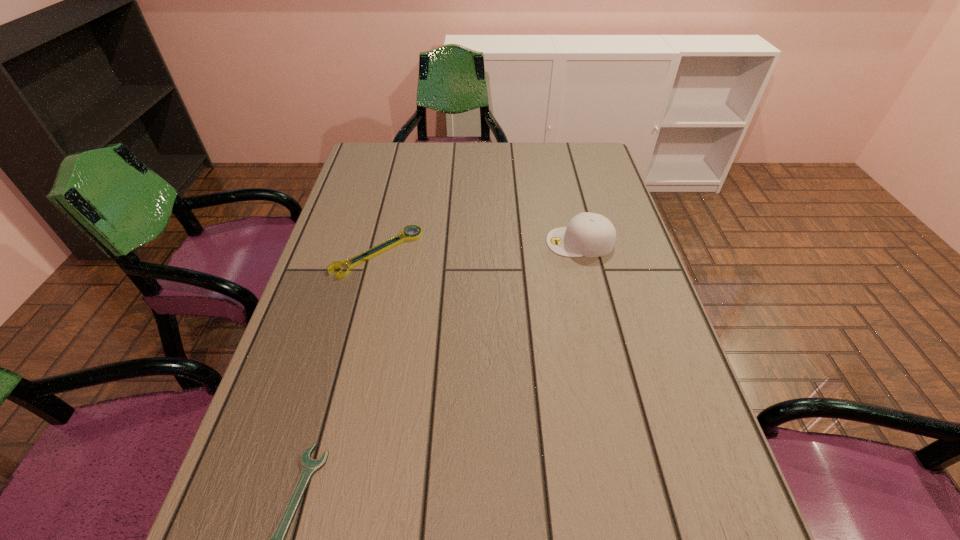
The height and width of the screenshot is (540, 960). Find the location of `free region at the right edge of the desktop`. free region at the right edge of the desktop is located at coordinates (679, 426).

Where is `vacant region at the far left corner`? Image resolution: width=960 pixels, height=540 pixels. vacant region at the far left corner is located at coordinates (355, 169).

This screenshot has height=540, width=960. What are the coordinates of `free point at the far right corner` in the screenshot? It's located at (594, 167).

You are a GUI agent. You are given a task and a screenshot of the screen. Output one action in this format:
    pyautogui.click(x=<x>, y=<y>)
    Task: Click on the free space between the farther wrench and the rightmost object
    Image resolution: width=960 pixels, height=540 pixels.
    Given the screenshot: What is the action you would take?
    pyautogui.click(x=479, y=247)

The image size is (960, 540). Identify the location of unoccupied position between the rightmost object and the farther wrench. (479, 247).

I want to click on empty space that is in between the cap and the farther wrench, so click(479, 247).

This screenshot has height=540, width=960. In order to click on free spot between the farther wrench and the rightmost object in this screenshot , I will do `click(479, 247)`.

Where is `object that ranks as the closest to the farther wrench`? The height and width of the screenshot is (540, 960). object that ranks as the closest to the farther wrench is located at coordinates (587, 234).

Locate an element on the screen. the second closest object to the nearest object is located at coordinates 587,234.

At what (x,y) coordinates should I click in order to perform the action: click on vacant space that satisfies the following two spatial constraints: 1. on the front-facing side of the rightmost object; 2. on the front side of the farther wrench. Please return your answer as a coordinate pair (x, y). The image size is (960, 540). Looking at the image, I should click on (583, 252).